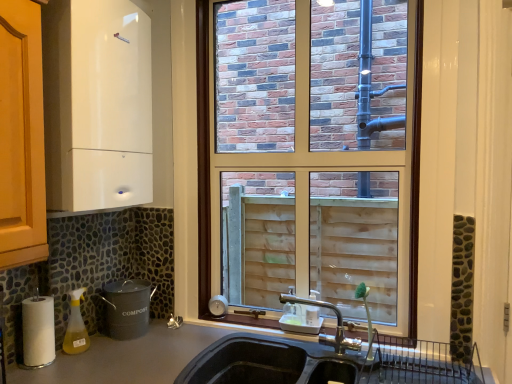
You are a GUI agent. You are given a task and a screenshot of the screen. Output one action in this format:
    pyautogui.click(x=<x>, y=<y>)
    Task: Click on the free location to the right of gray matte compost bin at lower left, the 1th appliance positioned from the bottom
    
    Given the screenshot: What is the action you would take?
    pyautogui.click(x=169, y=329)